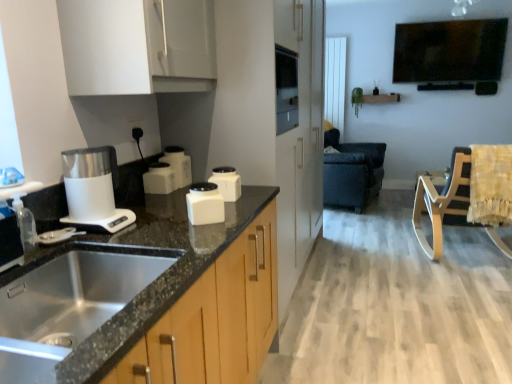
Measure the distance between white glossy container at center, the fourth kitchen appliance viewed from the back, and camera.

white glossy container at center, the fourth kitchen appliance viewed from the back, is 4.69 feet from camera.

Find the location of `stainless steel sink at lower left`. stainless steel sink at lower left is located at coordinates (68, 302).

Image resolution: width=512 pixels, height=384 pixels. What do you see at coordinates (68, 302) in the screenshot? I see `stainless steel sink at lower left` at bounding box center [68, 302].

Where is `dark leather rocking chair at center, the second rocking chair positioned from the front`? The width and height of the screenshot is (512, 384). dark leather rocking chair at center, the second rocking chair positioned from the front is located at coordinates (351, 171).

What is the approximate width of wooden rocking chair at right, which ranks as the first rocking chair in front-to-back order?

It is 38.10 inches.

The width and height of the screenshot is (512, 384). In order to click on black glossy tv at upper right in this screenshot , I will do `click(449, 51)`.

This screenshot has width=512, height=384. What do you see at coordinates (449, 51) in the screenshot?
I see `black glossy tv at upper right` at bounding box center [449, 51].

Identify the location of white glossy container at center, the 1th kitchen appliance when ordered from front to back. The width and height of the screenshot is (512, 384). (205, 204).

Is white glossy container at center, positioned as the 4th kitchen appliance in front-to-back order, facing away from black glossy tv at upper right?

No, white glossy container at center, positioned as the 4th kitchen appliance in front-to-back order, is not facing away from black glossy tv at upper right.

Is point (178, 148) positioned after point (401, 61)?

No, (178, 148) is closer to viewer.

Consider the image. How distant is white glossy container at center, positioned as the 4th kitchen appliance in front-to-back order, from black glossy tv at upper right?

4.43 meters.

Is white glossy container at center, positioned as the 4th kitchen appliance in front-to-back order, not near black glossy tv at upper right?

Absolutely, white glossy container at center, positioned as the 4th kitchen appliance in front-to-back order, is distant from black glossy tv at upper right.

Is white matte cabinet at upper left taller or shorter than dark leather rocking chair at center, the 1th rocking chair positioned from the back?

Considering their sizes, white matte cabinet at upper left has less height than dark leather rocking chair at center, the 1th rocking chair positioned from the back.

Measure the distance from white matte cabinet at upper left to dark leather rocking chair at center, the 1th rocking chair positioned from the back.

white matte cabinet at upper left is 3.12 meters from dark leather rocking chair at center, the 1th rocking chair positioned from the back.

Is white matte cabinet at upper left next to dark leather rocking chair at center, the 1th rocking chair positioned from the back?

No, white matte cabinet at upper left is not touching dark leather rocking chair at center, the 1th rocking chair positioned from the back.

How many degrees apart are the facing directions of white matte cabinet at upper left and dark leather rocking chair at center, the second rocking chair positioned from the front?

The facing directions of white matte cabinet at upper left and dark leather rocking chair at center, the second rocking chair positioned from the front, are 12.6 degrees apart.

Can you confirm if white matte container at center, the 3th kitchen appliance from the back, is shorter than wooden rocking chair at right, the 2th rocking chair when ordered from back to front?

Yes.

How many degrees apart are the facing directions of white matte container at center, the 2th kitchen appliance positioned from the front, and wooden rocking chair at right, which ranks as the first rocking chair in front-to-back order?

The angular difference between white matte container at center, the 2th kitchen appliance positioned from the front, and wooden rocking chair at right, which ranks as the first rocking chair in front-to-back order, is 93.7 degrees.

In terms of width, does white matte container at center, the 3th kitchen appliance from the back, look wider or thinner when compared to wooden rocking chair at right, the 2th rocking chair when ordered from back to front?

Considering their sizes, white matte container at center, the 3th kitchen appliance from the back, looks slimmer than wooden rocking chair at right, the 2th rocking chair when ordered from back to front.

Is white glossy container at center, placed as the 1th kitchen appliance when sorted from back to front, to the left of stainless steel sink at lower left from the viewer's perspective?

No.

Is white glossy container at center, placed as the 1th kitchen appliance when sorted from back to front, inside or outside of stainless steel sink at lower left?

white glossy container at center, placed as the 1th kitchen appliance when sorted from back to front, cannot be found inside stainless steel sink at lower left.

From the image's perspective, which object appears higher, white glossy container at center, placed as the 1th kitchen appliance when sorted from back to front, or stainless steel sink at lower left?

white glossy container at center, placed as the 1th kitchen appliance when sorted from back to front, is shown above in the image.

Looking at this image, considering the sizes of objects white glossy container at center, positioned as the 4th kitchen appliance in front-to-back order, and stainless steel sink at lower left in the image provided, who is wider, white glossy container at center, positioned as the 4th kitchen appliance in front-to-back order, or stainless steel sink at lower left?

Wider between the two is stainless steel sink at lower left.

Is white matte cabinet at upper left positioned far away from white glossy container at center, the 1th kitchen appliance when ordered from front to back?

Actually, white matte cabinet at upper left and white glossy container at center, the 1th kitchen appliance when ordered from front to back, are a little close together.

Does white matte cabinet at upper left lie behind white glossy container at center, the 1th kitchen appliance when ordered from front to back?

No, white matte cabinet at upper left is closer to the viewer.

From the image's perspective, which kitchen appliance is the 4th one below the white matte cabinet at upper left? Please provide its 2D coordinates.

[(205, 204)]

How different are the orientations of white glossy container at center, placed as the 1th kitchen appliance when sorted from back to front, and wooden rocking chair at right, the 2th rocking chair when ordered from back to front, in degrees?

There is a 102-degree angle between the facing directions of white glossy container at center, placed as the 1th kitchen appliance when sorted from back to front, and wooden rocking chair at right, the 2th rocking chair when ordered from back to front.

From the image's perspective, is white glossy container at center, positioned as the 4th kitchen appliance in front-to-back order, below wooden rocking chair at right, the 2th rocking chair when ordered from back to front?

No, from the image's perspective, white glossy container at center, positioned as the 4th kitchen appliance in front-to-back order, is not below wooden rocking chair at right, the 2th rocking chair when ordered from back to front.

Is white glossy container at center, positioned as the 4th kitchen appliance in front-to-back order, with wooden rocking chair at right, which ranks as the first rocking chair in front-to-back order?

No, white glossy container at center, positioned as the 4th kitchen appliance in front-to-back order, is not touching wooden rocking chair at right, which ranks as the first rocking chair in front-to-back order.

Is white glossy container at center, positioned as the 4th kitchen appliance in front-to-back order, looking in the opposite direction of wooden rocking chair at right, which ranks as the first rocking chair in front-to-back order?

white glossy container at center, positioned as the 4th kitchen appliance in front-to-back order, does not have its back to wooden rocking chair at right, which ranks as the first rocking chair in front-to-back order.

Is the depth of dark leather rocking chair at center, the second rocking chair positioned from the front, less than that of white glossy container at center, placed as the 1th kitchen appliance when sorted from back to front?

No, dark leather rocking chair at center, the second rocking chair positioned from the front, is further to the viewer.

Which is behind, point (355, 192) or point (174, 165)?

The point (355, 192) is more distant.

Is white glossy container at center, positioned as the 4th kitchen appliance in front-to-back order, a part of dark leather rocking chair at center, the 1th rocking chair positioned from the back?

Actually, white glossy container at center, positioned as the 4th kitchen appliance in front-to-back order, is outside dark leather rocking chair at center, the 1th rocking chair positioned from the back.

Identify the location of the 2nd rocking chair behind when counting from the white glossy container at center, positioned as the 4th kitchen appliance in front-to-back order. The image size is (512, 384). (351, 171).

This screenshot has height=384, width=512. Find the location of `window screen above the white glossy container at center, positioned as the 4th kitchen appliance in front-to-back order (from the image's perspective)`. window screen above the white glossy container at center, positioned as the 4th kitchen appliance in front-to-back order (from the image's perspective) is located at coordinates (449, 51).

Locate an element on the screen. the 1st rocking chair to the right of the white matte cabinet at upper left, starting your count from the anchor is located at coordinates (351, 171).

From the image, which object appears to be nearer to white glossy kettle at left, black glossy tv at upper right or yellow fabric swivel chair at right?

yellow fabric swivel chair at right.

From the image, which object appears to be farther from black glossy tv at upper right, white glossy container at center, placed as the 1th kitchen appliance when sorted from back to front, or white glossy container at center, marked as the 2th kitchen appliance in a back-to-front arrangement?

white glossy container at center, marked as the 2th kitchen appliance in a back-to-front arrangement.

Estimate the real-world distances between objects in this image. Which object is further from white matte cabinet at upper left, white glossy container at center, the fourth kitchen appliance viewed from the back, or white matte container at center, the 2th kitchen appliance positioned from the front?

white matte container at center, the 2th kitchen appliance positioned from the front, is positioned further to the anchor white matte cabinet at upper left.

When comparing their distances from black glossy tv at upper right, does yellow fabric swivel chair at right or clear plastic spray bottle at left seem closer?

The object closer to black glossy tv at upper right is yellow fabric swivel chair at right.

Considering their positions, is white glossy container at center, marked as the 2th kitchen appliance in a back-to-front arrangement, positioned further to black glossy tv at upper right than white glossy kettle at left?

The object further to black glossy tv at upper right is white glossy kettle at left.

Estimate the real-world distances between objects in this image. Which object is further from white matte cabinet at upper left, white glossy container at center, marked as the 2th kitchen appliance in a back-to-front arrangement, or black glossy tv at upper right?

black glossy tv at upper right is positioned further to the anchor white matte cabinet at upper left.

From the image, which object appears to be nearer to white glossy container at center, positioned as the 4th kitchen appliance in front-to-back order, white glossy container at center, the 1th kitchen appliance when ordered from front to back, or black glossy tv at upper right?

white glossy container at center, the 1th kitchen appliance when ordered from front to back, is positioned closer to the anchor white glossy container at center, positioned as the 4th kitchen appliance in front-to-back order.

Estimate the real-world distances between objects in this image. Which object is closer to white glossy container at center, the 1th kitchen appliance when ordered from front to back, white glossy container at center, the third kitchen appliance in the front-to-back sequence, or white glossy kettle at left?

The object closer to white glossy container at center, the 1th kitchen appliance when ordered from front to back, is white glossy kettle at left.

Where is `cabinetry between stainless steel sink at lower left and wooden rocking chair at right, which ranks as the first rocking chair in front-to-back order, from left to right`? Image resolution: width=512 pixels, height=384 pixels. cabinetry between stainless steel sink at lower left and wooden rocking chair at right, which ranks as the first rocking chair in front-to-back order, from left to right is located at coordinates (138, 46).

Locate an element on the screen. swivel chair between white matte cabinet at upper left and dark leather rocking chair at center, the 1th rocking chair positioned from the back, along the z-axis is located at coordinates (490, 189).

What are the coordinates of `home appliance between white matte cabinet at upper left and black glossy tv at upper right in the front-back direction` in the screenshot? It's located at (93, 189).

Where is `cabinetry situated between white glossy kettle at left and yellow fabric swivel chair at right from left to right`? cabinetry situated between white glossy kettle at left and yellow fabric swivel chair at right from left to right is located at coordinates (138, 46).